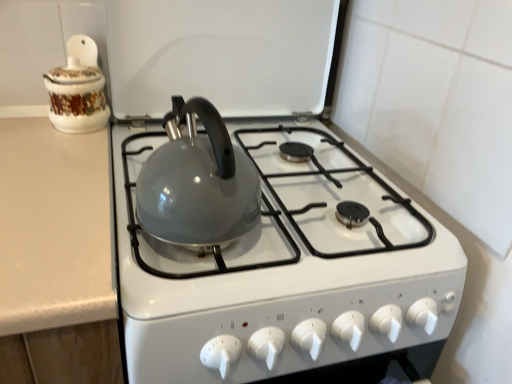
Question: Considering the relative positions of glossy ceramic kettle at center and porcelain floral jar at upper left in the image provided, is glossy ceramic kettle at center to the right of porcelain floral jar at upper left from the viewer's perspective?

Choices:
 (A) no
 (B) yes

Answer: (B)

Question: Could you tell me if glossy ceramic kettle at center is turned towards porcelain floral jar at upper left?

Choices:
 (A) yes
 (B) no

Answer: (A)

Question: From a real-world perspective, is glossy ceramic kettle at center below porcelain floral jar at upper left?

Choices:
 (A) no
 (B) yes

Answer: (B)

Question: Can you confirm if glossy ceramic kettle at center is thinner than porcelain floral jar at upper left?

Choices:
 (A) no
 (B) yes

Answer: (A)

Question: From the image's perspective, would you say glossy ceramic kettle at center is positioned over porcelain floral jar at upper left?

Choices:
 (A) no
 (B) yes

Answer: (A)

Question: Considering the relative sizes of glossy ceramic kettle at center and porcelain floral jar at upper left in the image provided, is glossy ceramic kettle at center smaller than porcelain floral jar at upper left?

Choices:
 (A) no
 (B) yes

Answer: (A)

Question: Is porcelain floral jar at upper left positioned in front of glossy ceramic kettle at center?

Choices:
 (A) yes
 (B) no

Answer: (B)

Question: Considering the relative sizes of porcelain floral jar at upper left and glossy ceramic kettle at center in the image provided, is porcelain floral jar at upper left thinner than glossy ceramic kettle at center?

Choices:
 (A) yes
 (B) no

Answer: (A)

Question: Does porcelain floral jar at upper left have a greater width compared to glossy ceramic kettle at center?

Choices:
 (A) no
 (B) yes

Answer: (A)

Question: From a real-world perspective, is porcelain floral jar at upper left positioned under glossy ceramic kettle at center based on gravity?

Choices:
 (A) no
 (B) yes

Answer: (A)

Question: Is porcelain floral jar at upper left next to glossy ceramic kettle at center and touching it?

Choices:
 (A) no
 (B) yes

Answer: (A)

Question: Does porcelain floral jar at upper left have a greater height compared to glossy ceramic kettle at center?

Choices:
 (A) yes
 (B) no

Answer: (B)

Question: Considering the positions of porcelain floral jar at upper left and glossy ceramic kettle at center in the image, is porcelain floral jar at upper left taller or shorter than glossy ceramic kettle at center?

Choices:
 (A) tall
 (B) short

Answer: (B)